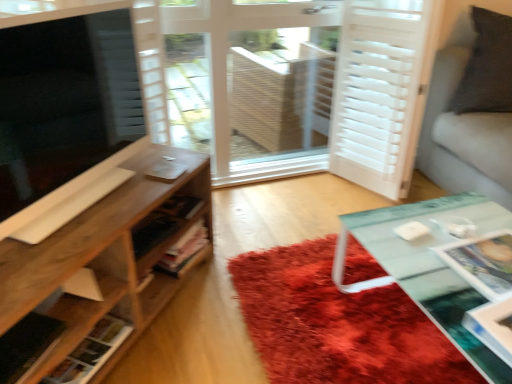
Question: Is white wooden screen door at center, arranged as the 1th screen door when viewed from the left, facing away from wooden shelf at lower left, which is the second shelf in top-to-bottom order?

Choices:
 (A) yes
 (B) no

Answer: (B)

Question: Does white wooden screen door at center, arranged as the 1th screen door when viewed from the left, have a lesser width compared to wooden shelf at lower left, marked as the first shelf in a bottom-to-top arrangement?

Choices:
 (A) yes
 (B) no

Answer: (B)

Question: Could you tell me if white wooden screen door at center, arranged as the 1th screen door when viewed from the left, is facing wooden shelf at lower left, which is the second shelf in top-to-bottom order?

Choices:
 (A) yes
 (B) no

Answer: (A)

Question: Is white wooden screen door at center, marked as the second screen door in a right-to-left arrangement, directly adjacent to wooden shelf at lower left, which is the second shelf in top-to-bottom order?

Choices:
 (A) yes
 (B) no

Answer: (B)

Question: Does white wooden screen door at center, marked as the second screen door in a right-to-left arrangement, have a lesser height compared to wooden shelf at lower left, which is the second shelf in top-to-bottom order?

Choices:
 (A) yes
 (B) no

Answer: (B)

Question: Considering the positions of wooden shelf at lower left, marked as the first shelf in a bottom-to-top arrangement, and wooden shelf at left, positioned as the first shelf in top-to-bottom order, in the image, is wooden shelf at lower left, marked as the first shelf in a bottom-to-top arrangement, taller or shorter than wooden shelf at left, positioned as the first shelf in top-to-bottom order,?

Choices:
 (A) tall
 (B) short

Answer: (B)

Question: From a real-world perspective, is wooden shelf at lower left, which is the second shelf in top-to-bottom order, above or below wooden shelf at left, positioned as the first shelf in top-to-bottom order?

Choices:
 (A) below
 (B) above

Answer: (A)

Question: Looking at their shapes, would you say wooden shelf at lower left, marked as the first shelf in a bottom-to-top arrangement, is wider or thinner than wooden shelf at left, positioned as the first shelf in top-to-bottom order?

Choices:
 (A) wide
 (B) thin

Answer: (B)

Question: From the image's perspective, is wooden shelf at lower left, which is the second shelf in top-to-bottom order, positioned above or below wooden shelf at left, positioned as the first shelf in top-to-bottom order?

Choices:
 (A) above
 (B) below

Answer: (B)

Question: Considering the positions of matte black tv at left and shaggy red rug at center in the image, is matte black tv at left bigger or smaller than shaggy red rug at center?

Choices:
 (A) big
 (B) small

Answer: (A)

Question: Considering the relative positions of matte black tv at left and shaggy red rug at center in the image provided, is matte black tv at left to the left or to the right of shaggy red rug at center?

Choices:
 (A) left
 (B) right

Answer: (A)

Question: From the image's perspective, relative to shaggy red rug at center, is matte black tv at left above or below?

Choices:
 (A) above
 (B) below

Answer: (A)

Question: Is matte black tv at left inside or outside of shaggy red rug at center?

Choices:
 (A) outside
 (B) inside

Answer: (A)

Question: In the image, is shaggy red rug at center positioned in front of or behind white matte screen door at right, the 2th screen door in the left-to-right sequence?

Choices:
 (A) behind
 (B) front

Answer: (B)

Question: Considering the relative positions of shaggy red rug at center and white matte screen door at right, the 2th screen door in the left-to-right sequence, in the image provided, is shaggy red rug at center to the left or to the right of white matte screen door at right, the 2th screen door in the left-to-right sequence,?

Choices:
 (A) left
 (B) right

Answer: (A)